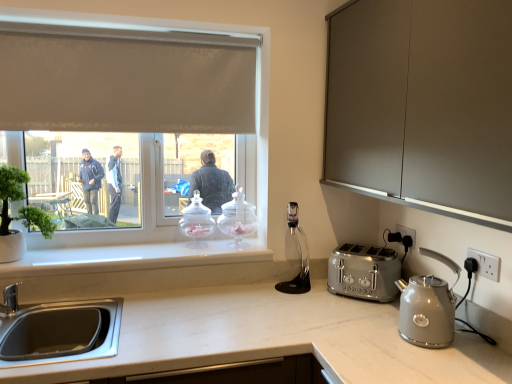
Consider the image. How much space does matte silver kettle at right, acting as the first kitchen appliance starting from the right, occupy vertically?

It is 8.12 inches.

In order to face matte gray cabinet at upper right, should I rotate leftwards or rightwards?

To align with it, rotate right about 22.271°.

Measure the distance between satin steel sink at lower left and camera.

They are 1.24 meters apart.

At what (x,y) coordinates should I click in order to perform the action: click on clear glass jar at window, which appears as the 3th kitchen appliance when viewed from the front. Please return your answer as a coordinate pair (x, y). The height and width of the screenshot is (384, 512). Looking at the image, I should click on (237, 219).

Is there a large distance between satin steel sink at lower left and clear glass jar at window, arranged as the 3th kitchen appliance when viewed from the right?

They are positioned close to each other.

Is satin steel sink at lower left aimed at clear glass jar at window, arranged as the 3th kitchen appliance when viewed from the right?

No, satin steel sink at lower left is not turned towards clear glass jar at window, arranged as the 3th kitchen appliance when viewed from the right.

Is clear glass jar at window, placed as the 2th kitchen appliance when sorted from back to front, located within satin steel sink at lower left?

No, clear glass jar at window, placed as the 2th kitchen appliance when sorted from back to front, is located outside of satin steel sink at lower left.

From a real-world perspective, is satin steel sink at lower left positioned above or below clear glass jar at window, the first kitchen appliance positioned from the left?

satin steel sink at lower left is situated lower than clear glass jar at window, the first kitchen appliance positioned from the left, in the real world.

Which point is more distant from viewer, (413, 244) or (345, 244)?

The point (345, 244) is behind.

Is black plastic electric outlet at lower right, which ranks as the 1th electric outlet in back-to-front order, with satin silver toaster at right?

No, black plastic electric outlet at lower right, which ranks as the 1th electric outlet in back-to-front order, is not beside satin silver toaster at right.

Would you say black plastic electric outlet at lower right, which ranks as the first electric outlet in left-to-right order, is outside satin silver toaster at right?

That's correct, black plastic electric outlet at lower right, which ranks as the first electric outlet in left-to-right order, is outside of satin silver toaster at right.

Looking at the image, does black plastic electric outlet at lower right, placed as the second electric outlet when sorted from front to back, seem bigger or smaller compared to satin silver toaster at right?

Clearly, black plastic electric outlet at lower right, placed as the second electric outlet when sorted from front to back, is smaller in size than satin silver toaster at right.

From a real-world perspective, is white plastic electric outlet at right, which is the second electric outlet in left-to-right order, below satin steel sink at lower left?

No, from a real-world perspective, white plastic electric outlet at right, which is the second electric outlet in left-to-right order, is not under satin steel sink at lower left.

Considering the sizes of white plastic electric outlet at right, positioned as the 1th electric outlet in right-to-left order, and satin steel sink at lower left in the image, is white plastic electric outlet at right, positioned as the 1th electric outlet in right-to-left order, bigger or smaller than satin steel sink at lower left?

white plastic electric outlet at right, positioned as the 1th electric outlet in right-to-left order, is smaller than satin steel sink at lower left.

Is point (486, 262) closer or farther from the camera than point (103, 340)?

Point (486, 262).

Is satin silver toaster at right inside or outside of white plastic electric outlet at right, which is the second electric outlet in left-to-right order?

satin silver toaster at right is not enclosed by white plastic electric outlet at right, which is the second electric outlet in left-to-right order.

Based on the photo, how different are the orientations of satin silver toaster at right and white plastic electric outlet at right, which is the second electric outlet in left-to-right order, in degrees?

The angular difference between satin silver toaster at right and white plastic electric outlet at right, which is the second electric outlet in left-to-right order, is 48.6 degrees.

From the image's perspective, does satin silver toaster at right appear lower than white plastic electric outlet at right, which is the second electric outlet in left-to-right order?

Yes.

Does satin silver toaster at right have a lesser height compared to white plastic electric outlet at right, which is the second electric outlet in left-to-right order?

No, satin silver toaster at right is not shorter than white plastic electric outlet at right, which is the second electric outlet in left-to-right order.

From the image's perspective, which one is positioned lower, green matte plant at left or white plastic electric outlet at right, marked as the second electric outlet in a back-to-front arrangement?

white plastic electric outlet at right, marked as the second electric outlet in a back-to-front arrangement, appears lower in the image.

Which object is positioned more to the right, green matte plant at left or white plastic electric outlet at right, which is the second electric outlet in left-to-right order?

Result: white plastic electric outlet at right, which is the second electric outlet in left-to-right order.

Between green matte plant at left and white plastic electric outlet at right, marked as the second electric outlet in a back-to-front arrangement, which one is positioned behind?

green matte plant at left is more distant.

Would you say green matte plant at left contains white plastic electric outlet at right, which is the 1th electric outlet from front to back?

No, white plastic electric outlet at right, which is the 1th electric outlet from front to back, is not surrounded by green matte plant at left.

Which of these two, clear glass jar at window, placed as the 2th kitchen appliance when sorted from left to right, or satin silver toaster at right, is thinner?

clear glass jar at window, placed as the 2th kitchen appliance when sorted from left to right, is thinner.

From the image's perspective, relative to satin silver toaster at right, is clear glass jar at window, which appears as the 3th kitchen appliance when viewed from the front, above or below?

clear glass jar at window, which appears as the 3th kitchen appliance when viewed from the front, is situated higher than satin silver toaster at right in the image.

How many degrees apart are the facing directions of clear glass jar at window, which appears as the 3th kitchen appliance when viewed from the front, and satin silver toaster at right?

43.8 degrees.

Considering the points (224, 220) and (337, 261), which point is in front, point (224, 220) or point (337, 261)?

The point (337, 261) is in front.

Would you say black plastic electric outlet at lower right, which is the 2th electric outlet from right to left, is a long distance from white plastic electric outlet at right, which is the 1th electric outlet from front to back?

No, black plastic electric outlet at lower right, which is the 2th electric outlet from right to left, is not far away from white plastic electric outlet at right, which is the 1th electric outlet from front to back.

Considering the sizes of black plastic electric outlet at lower right, which is the 2th electric outlet from right to left, and white plastic electric outlet at right, which is the 1th electric outlet from front to back, in the image, is black plastic electric outlet at lower right, which is the 2th electric outlet from right to left, bigger or smaller than white plastic electric outlet at right, which is the 1th electric outlet from front to back,?

Clearly, black plastic electric outlet at lower right, which is the 2th electric outlet from right to left, is larger in size than white plastic electric outlet at right, which is the 1th electric outlet from front to back.

Is black plastic electric outlet at lower right, which is the 2th electric outlet from right to left, completely or partially outside of white plastic electric outlet at right, which is the 1th electric outlet from front to back?

Absolutely, black plastic electric outlet at lower right, which is the 2th electric outlet from right to left, is external to white plastic electric outlet at right, which is the 1th electric outlet from front to back.

Looking at this image, in the image, is black plastic electric outlet at lower right, which ranks as the 1th electric outlet in back-to-front order, on the left side or the right side of white plastic electric outlet at right, marked as the second electric outlet in a back-to-front arrangement?

In the image, black plastic electric outlet at lower right, which ranks as the 1th electric outlet in back-to-front order, appears on the left side of white plastic electric outlet at right, marked as the second electric outlet in a back-to-front arrangement.

Locate an element on the screen. kitchen appliance that is the 2nd one when counting upward from the satin steel sink at lower left (from the image's perspective) is located at coordinates (196, 222).

The height and width of the screenshot is (384, 512). In the image, there is a black plastic electric outlet at lower right, which is the 2th electric outlet from right to left. What are the coordinates of `toaster below it (from a real-world perspective)` in the screenshot? It's located at (364, 272).

Estimate the real-world distances between objects in this image. Which object is further from matte gray cabinet at upper right, white glossy window sill at lower center or green matte plant at left?

green matte plant at left is further to matte gray cabinet at upper right.

When comparing their distances from black plastic electric outlet at lower right, which ranks as the first electric outlet in left-to-right order, does green matte plant at left or white fabric window at upper left seem closer?

white fabric window at upper left is positioned closer to the anchor black plastic electric outlet at lower right, which ranks as the first electric outlet in left-to-right order.

Based on their spatial positions, is matte gray cabinet at upper right or satin silver toaster at right further from green matte plant at left?

matte gray cabinet at upper right.

When comparing their distances from clear glass jar at window, arranged as the 3th kitchen appliance when viewed from the right, does satin steel sink at lower left or satin silver toaster at right seem closer?

satin steel sink at lower left is closer to clear glass jar at window, arranged as the 3th kitchen appliance when viewed from the right.

From the image, which object appears to be nearer to white glossy window sill at lower center, clear glass jar at window, arranged as the 3th kitchen appliance when viewed from the right, or black plastic electric outlet at lower right, which ranks as the first electric outlet in left-to-right order?

clear glass jar at window, arranged as the 3th kitchen appliance when viewed from the right, lies closer to white glossy window sill at lower center than the other object.

From the image, which object appears to be nearer to matte gray cabinet at upper right, green matte plant at left or matte silver kettle at right, placed as the 3th kitchen appliance when sorted from back to front?

Based on the image, matte silver kettle at right, placed as the 3th kitchen appliance when sorted from back to front, appears to be nearer to matte gray cabinet at upper right.

Considering their positions, is white plastic electric outlet at right, which is the 1th electric outlet from front to back, positioned further to clear glass jar at window, placed as the 2th kitchen appliance when sorted from back to front, than white glossy window sill at lower center?

white plastic electric outlet at right, which is the 1th electric outlet from front to back.

Considering their positions, is white glossy window sill at lower center positioned further to black plastic electric outlet at lower right, which is the 2th electric outlet from right to left, than white plastic electric outlet at right, which is the 1th electric outlet from front to back?

white glossy window sill at lower center is further to black plastic electric outlet at lower right, which is the 2th electric outlet from right to left.

This screenshot has height=384, width=512. In order to click on window sill between green matte plant at left and clear glass jar at window, the 2th kitchen appliance from the front in this screenshot , I will do click(x=131, y=258).

The height and width of the screenshot is (384, 512). Identify the location of window sill between satin steel sink at lower left and white plastic electric outlet at right, positioned as the 1th electric outlet in right-to-left order. (131, 258).

Where is `electric outlet between matte gray cabinet at upper right and black plastic electric outlet at lower right, placed as the second electric outlet when sorted from front to back, in the front-back direction`? electric outlet between matte gray cabinet at upper right and black plastic electric outlet at lower right, placed as the second electric outlet when sorted from front to back, in the front-back direction is located at coordinates (486, 264).

This screenshot has height=384, width=512. What are the coordinates of `toaster between green matte plant at left and matte gray cabinet at upper right from left to right` in the screenshot? It's located at (364, 272).